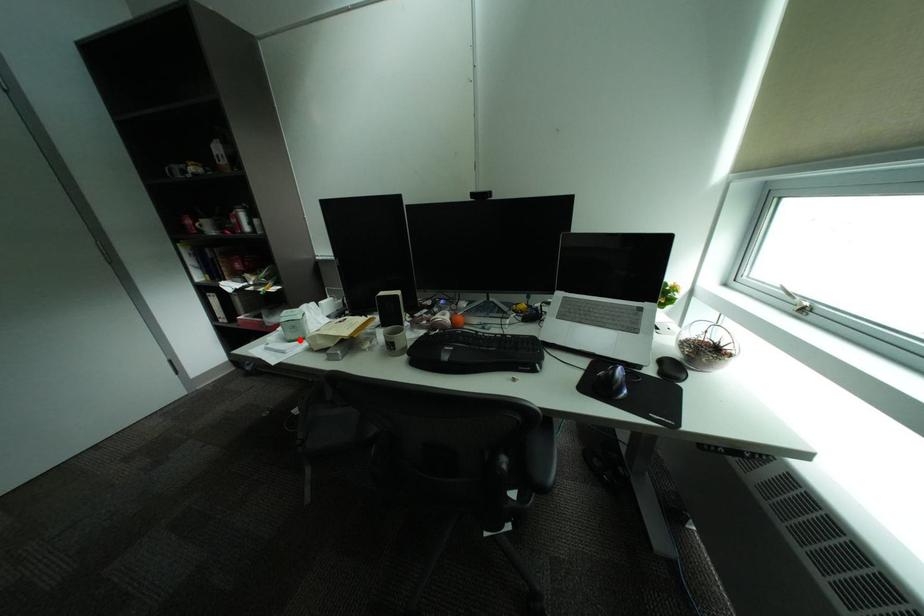
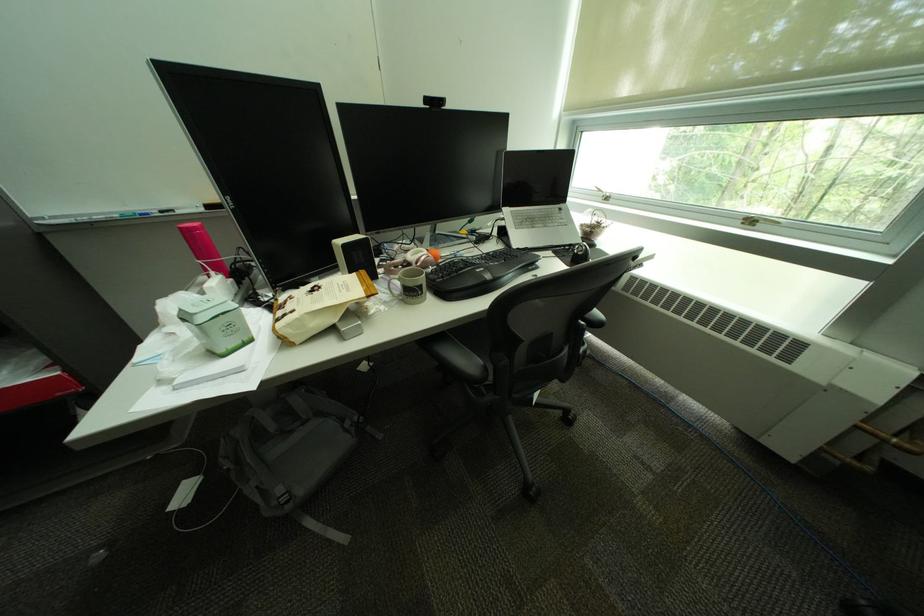
Question: A red point is marked in image1. In image2, is the corresponding 3D point closer to the camera or farther? Reply with the corresponding letter.

Choices:
 (A) The corresponding 3D point is closer.
 (B) The corresponding 3D point is farther.

Answer: (A)